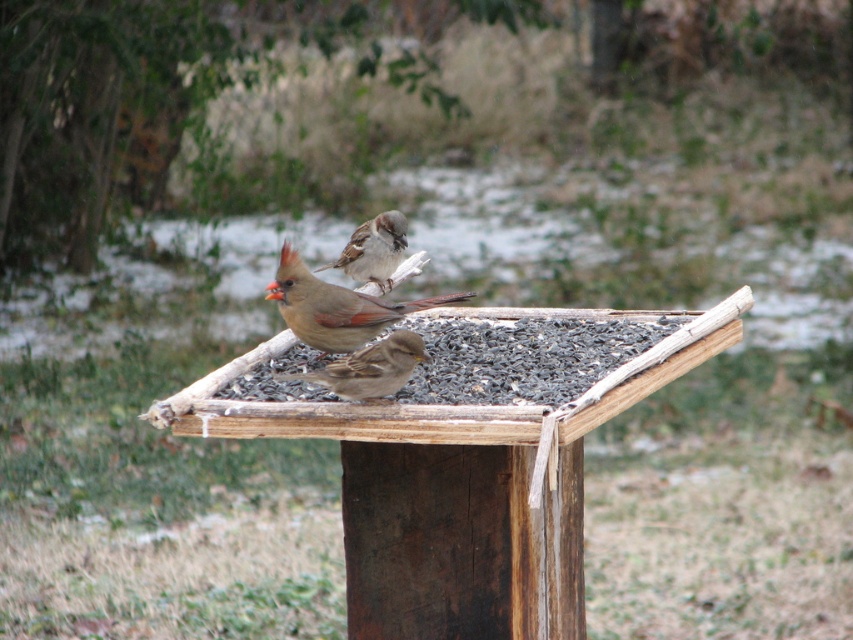
Question: Does brown speckled sparrow at center appear on the left side of brown matte sparrow at center?

Choices:
 (A) no
 (B) yes

Answer: (A)

Question: Does brown speckled sparrow at center appear over brown feathered sparrow at center?

Choices:
 (A) yes
 (B) no

Answer: (A)

Question: Among these objects, which one is farthest from the camera?

Choices:
 (A) brown feathered sparrow at center
 (B) brown speckled sparrow at center
 (C) brown matte sparrow at center

Answer: (C)

Question: Is brown speckled sparrow at center above brown feathered sparrow at center?

Choices:
 (A) yes
 (B) no

Answer: (A)

Question: Which point is closer to the camera taking this photo?

Choices:
 (A) (361, 268)
 (B) (351, 300)
 (C) (308, 372)

Answer: (C)

Question: Which of the following is the farthest from the observer?

Choices:
 (A) brown speckled sparrow at center
 (B) brown matte sparrow at center

Answer: (B)